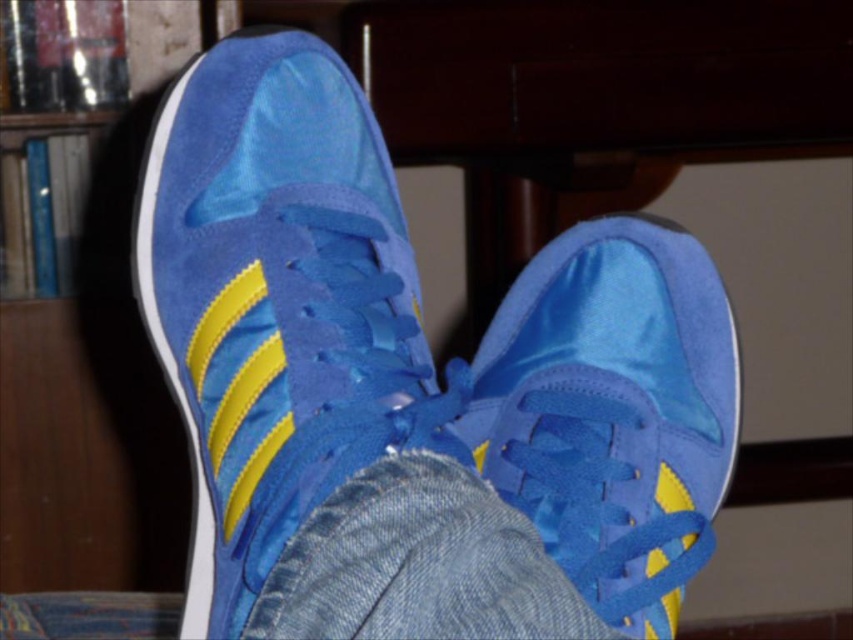
You are organizing items on a narrow shelf that can only hold items up to the width of the matte wood bookshelf at left. Can the satin blue sneaker at center fit on this shelf?

The satin blue sneaker at center is thinner than the matte wood bookshelf at left, so it can fit on the shelf since its width is within the allowed limit.

You are organizing a space and want to place a decorative item on the matte wood bookshelf at left. Considering the blue suede shoe at center is currently under it, where should you place the decorative item to avoid blocking the shoe?

Place the decorative item on the matte wood bookshelf at left above the blue suede shoe at center since the shoe is positioned under the bookshelf.

You are organizing a shoe display and need to arrange the satin blue sneaker at center and the blue suede shoe at center without overlapping. Which one should you place on top to match the current arrangement?

The satin blue sneaker at center is positioned over the blue suede shoe at center in the current arrangement, so to match it, you should place the satin blue sneaker at center on top of the blue suede shoe at center.